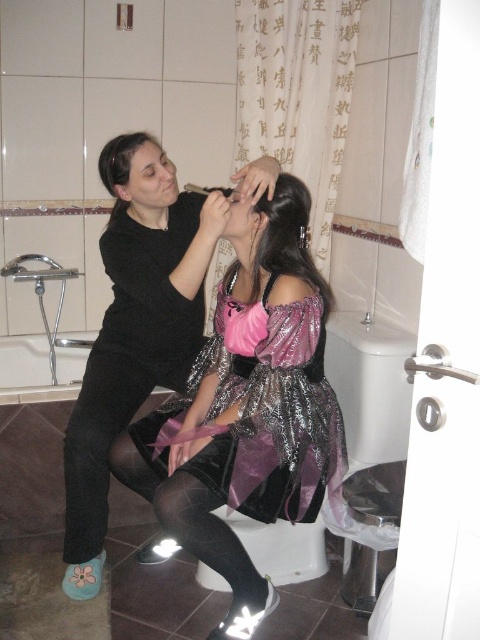
In the bathroom scene, there is a white glossy toilet bowl at lower center and a dark brown silky hair at upper center. Which object takes up more space in the image?

The white glossy toilet bowl at lower center takes up more space in the image because it has a larger size compared to the dark brown silky hair at upper center.

What is the location of the shiny dark hair at center?

The shiny dark hair at center is located at point (288, 237).

You are a photographer taking a picture of the two people in the bathroom scene. You notice the shiny dark hair at center and the dark brown silky hair at upper center. Which hair is taller?

The shiny dark hair at center is much taller than the dark brown silky hair at upper center.